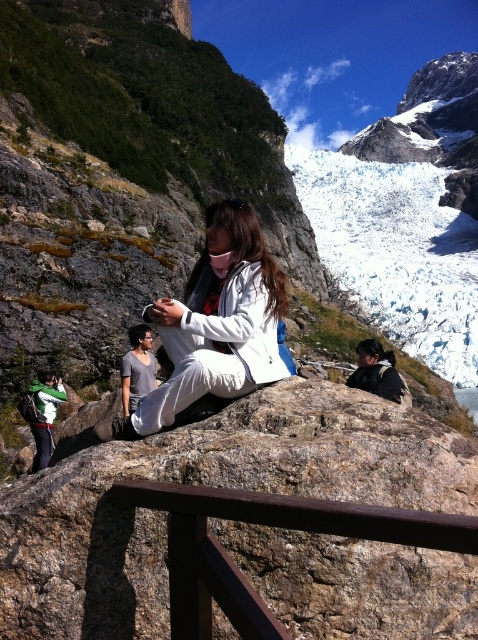
Between brown rough rock at center and white matte jacket at center, which one is positioned lower?

brown rough rock at center is below.

Who is more distant from viewer, [322,486] or [188,401]?

Point [188,401]

Image resolution: width=478 pixels, height=640 pixels. What are the coordinates of `brown rough rock at center` in the screenshot? It's located at (208, 484).

Does white matte jacket at center have a lesser width compared to matte black jacket at center?

No, white matte jacket at center is not thinner than matte black jacket at center.

Is point (281, 282) positioned before point (391, 372)?

That is True.

You are a GUI agent. You are given a task and a screenshot of the screen. Output one action in this format:
    pyautogui.click(x=<x>, y=<y>)
    Task: Click on the white matte jacket at center
    
    Given the screenshot: What is the action you would take?
    pyautogui.click(x=215, y=324)

Does brown wood rail at center appear on the right side of matte black jacket at center?

Incorrect, brown wood rail at center is not on the right side of matte black jacket at center.

Does brown wood rail at center lie behind matte black jacket at center?

No.

Image resolution: width=478 pixels, height=640 pixels. In order to click on brown wood rail at center in this screenshot , I will do `click(268, 525)`.

Where is `brown wood rail at center`? The width and height of the screenshot is (478, 640). brown wood rail at center is located at coordinates (268, 525).